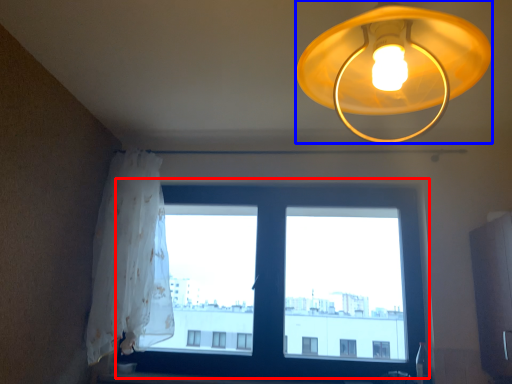
Question: Which object is closer to the camera taking this photo, window (highlighted by a red box) or lamp (highlighted by a blue box)?

Choices:
 (A) window
 (B) lamp

Answer: (B)